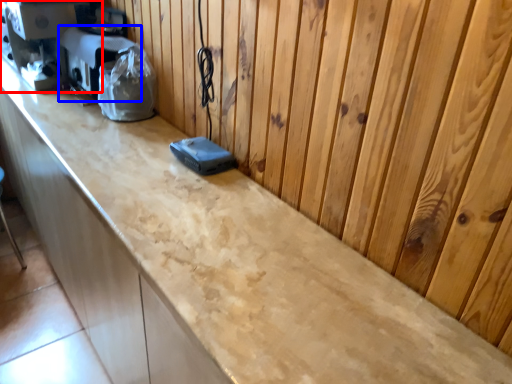
Question: Which of the following is the closest to the observer, coffee machine (highlighted by a red box) or appliance (highlighted by a blue box)?

Choices:
 (A) coffee machine
 (B) appliance

Answer: (B)